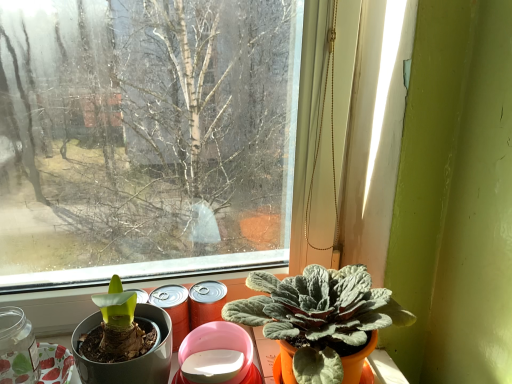
Question: Is transparent glass jar at lower left spatially inside silvery-green felt-like plant at lower right, or outside of it?

Choices:
 (A) outside
 (B) inside

Answer: (A)

Question: From a real-world perspective, relative to silvery-green felt-like plant at lower right, is transparent glass jar at lower left vertically above or below?

Choices:
 (A) below
 (B) above

Answer: (A)

Question: Is transparent glass jar at lower left to the left or to the right of silvery-green felt-like plant at lower right in the image?

Choices:
 (A) right
 (B) left

Answer: (B)

Question: Is silvery-green felt-like plant at lower right situated inside transparent glass jar at lower left or outside?

Choices:
 (A) inside
 (B) outside

Answer: (B)

Question: Based on their sizes in the image, would you say silvery-green felt-like plant at lower right is bigger or smaller than transparent glass jar at lower left?

Choices:
 (A) big
 (B) small

Answer: (A)

Question: Is silvery-green felt-like plant at lower right in front of or behind transparent glass jar at lower left in the image?

Choices:
 (A) front
 (B) behind

Answer: (A)

Question: Is point (354, 370) closer or farther from the camera than point (20, 367)?

Choices:
 (A) farther
 (B) closer

Answer: (B)